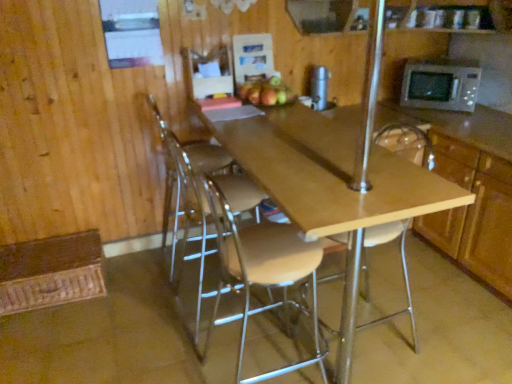
The width and height of the screenshot is (512, 384). Identify the location of empty space that is to the right of brown woven mat at lower left. (133, 294).